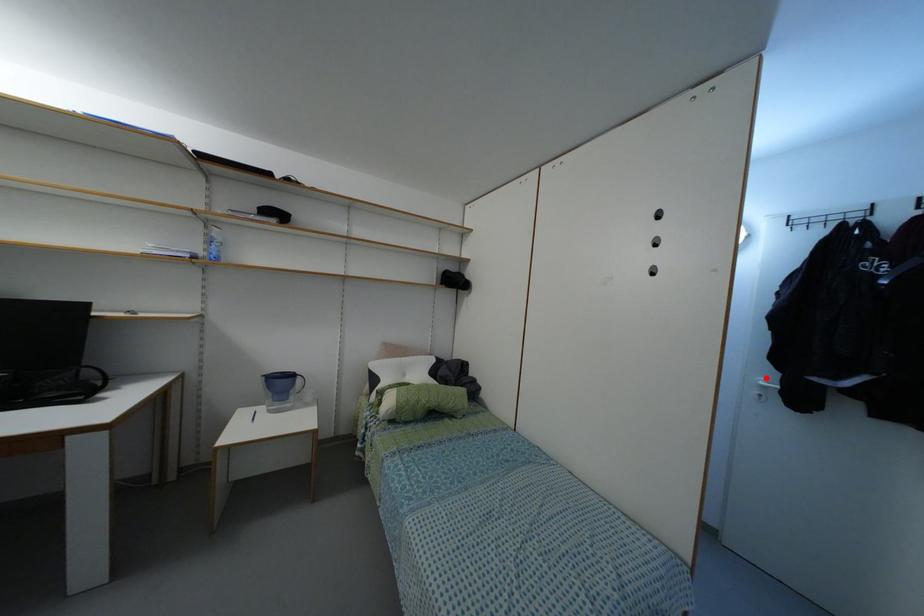
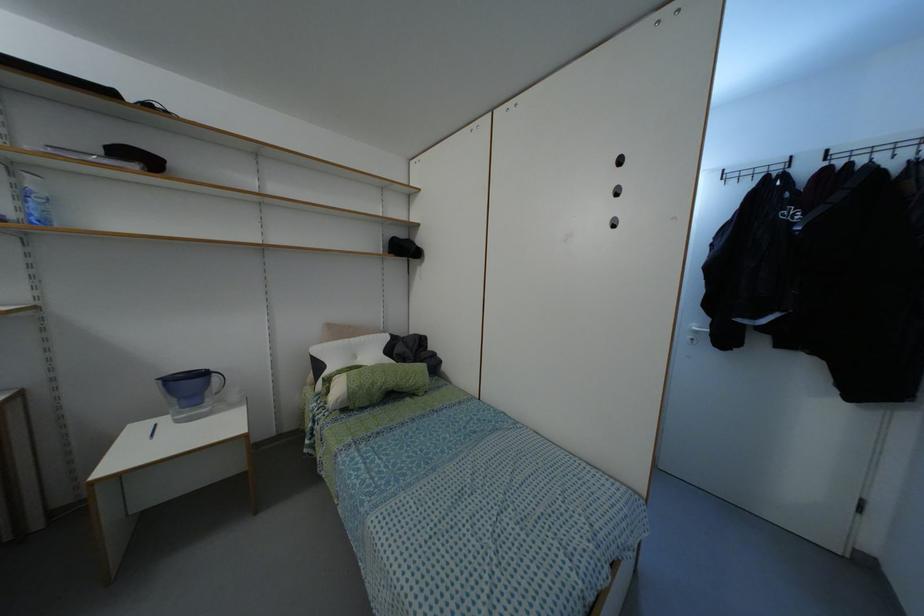
Locate, in the second image, the point that corresponds to the highlighted location in the first image.

(698, 323)